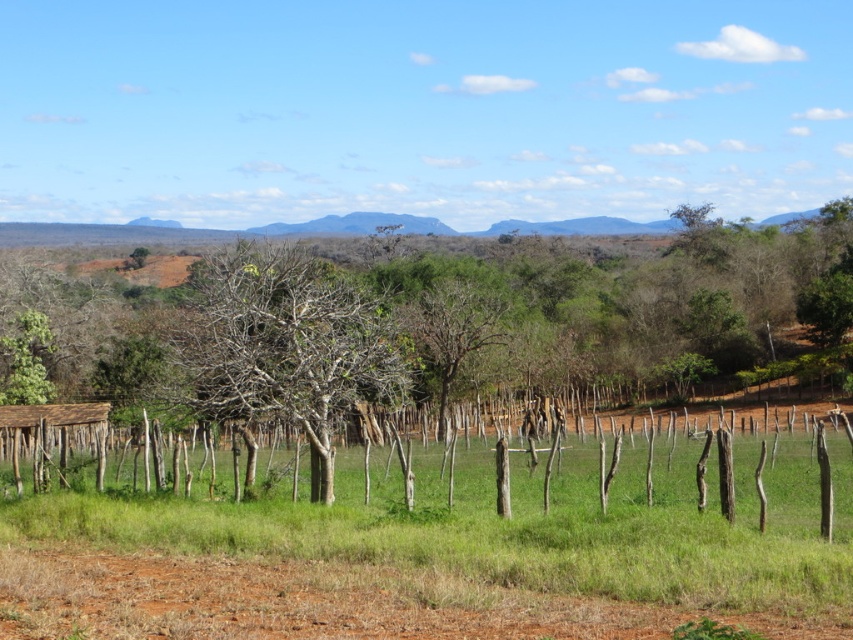
From the picture: You are standing at the base of the bare wood tree at center and want to place a birdhouse on it. The birdhouse requires a tree that is taller than the brown wooden hut at lower left. Can you place the birdhouse here?

The bare wood tree at center has a greater height compared to the brown wooden hut at lower left, so yes, you can place the birdhouse here because the tree meets the height requirement.

You are standing at the top of a hill overlooking the landscape. You see a bare wood tree at center and a brown wooden hut at lower left. Which object is positioned higher in the scene?

The bare wood tree at center is located above the brown wooden hut at lower left, so it is positioned higher in the scene.

You are standing in the middle of the grassy area in the rural landscape. You see two points marked on the ground. One is at point coordinates point (281, 620) and the other is at point coordinates point (386, 316). Which point is closer to you?

Point (281, 620) is closer to the camera than point (386, 316), so the point at coordinates point (281, 620) is closer to you.